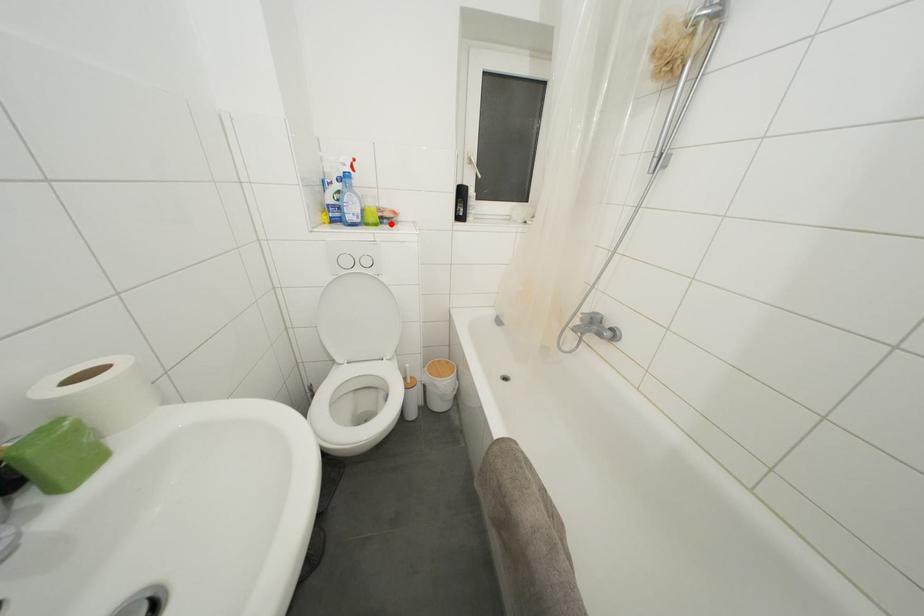
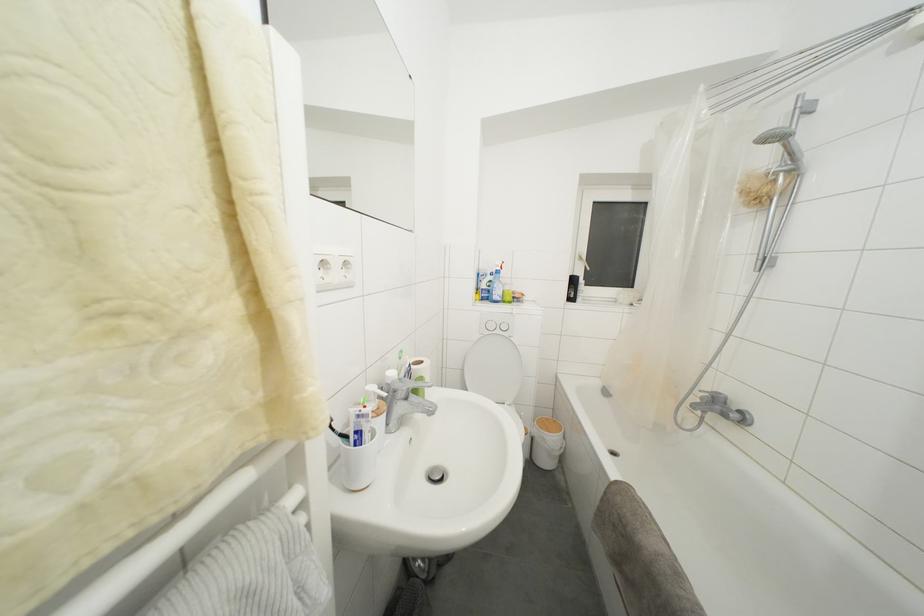
In the second image, find the point that corresponds to the highlighted location in the first image.

(520, 304)